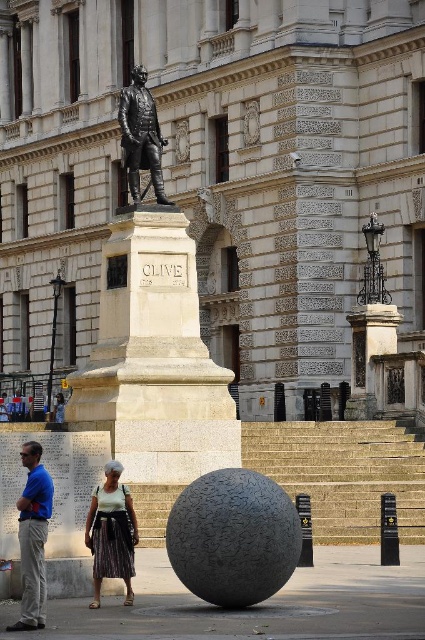
You are a tourist visiting the public square and notice the blue shirt at lower left and the bronze statue at center. Which object is positioned lower in the image?

The blue shirt at lower left is positioned below the bronze statue at center, so it is lower in the image.